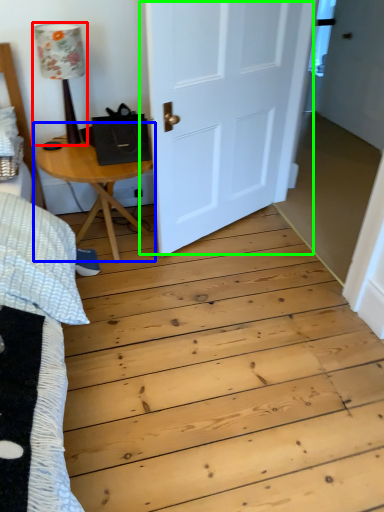
Question: Which is nearer to the lamp (highlighted by a red box)? table (highlighted by a blue box) or door (highlighted by a green box).

Choices:
 (A) table
 (B) door

Answer: (A)